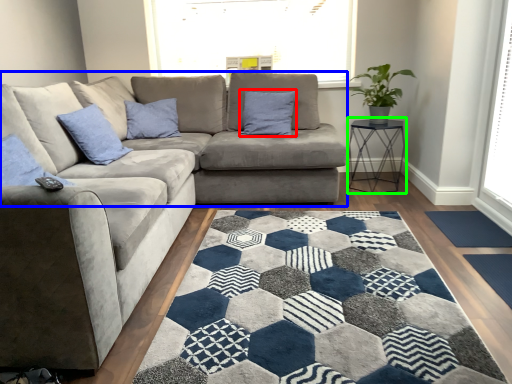
Question: Based on their relative distances, which object is farther from pillow (highlighted by a red box)? Choose from futon (highlighted by a blue box) and table (highlighted by a green box).

Choices:
 (A) futon
 (B) table

Answer: (B)